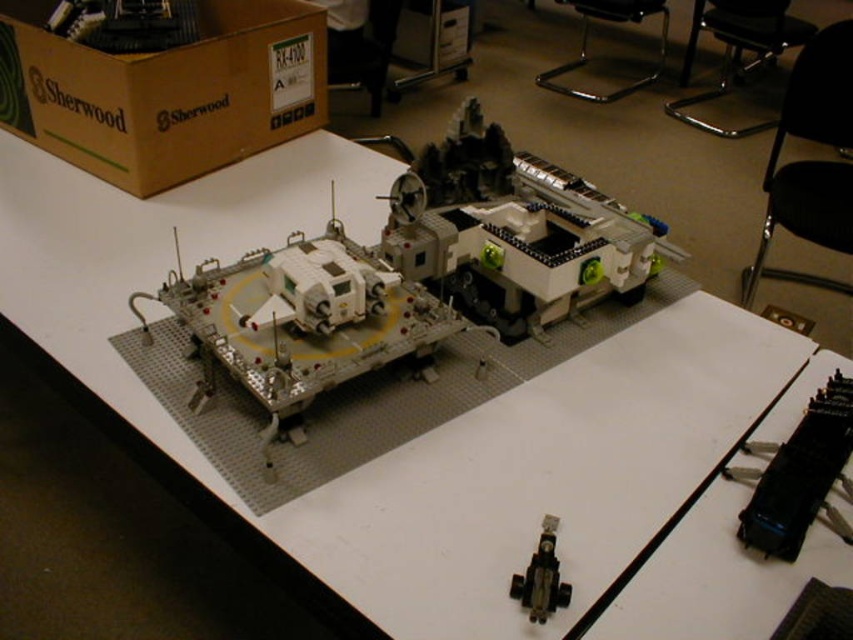
Is beige plastic space vehicle at center wider than white plastic vehicle at center?

Correct, the width of beige plastic space vehicle at center exceeds that of white plastic vehicle at center.

Can you confirm if beige plastic space vehicle at center is positioned to the left of white plastic vehicle at center?

No, beige plastic space vehicle at center is not to the left of white plastic vehicle at center.

Is point (381, 268) positioned before point (396, 349)?

No, (381, 268) is behind (396, 349).

Identify the location of beige plastic space vehicle at center. Image resolution: width=853 pixels, height=640 pixels. (410, 275).

Is the position of brown cardboard box at upper left less distant than that of black plastic train at lower right?

No, it is behind black plastic train at lower right.

The width and height of the screenshot is (853, 640). What do you see at coordinates (165, 92) in the screenshot?
I see `brown cardboard box at upper left` at bounding box center [165, 92].

The width and height of the screenshot is (853, 640). Find the location of `brown cardboard box at upper left`. brown cardboard box at upper left is located at coordinates (165, 92).

Does beige plastic space vehicle at center come behind metallic black usb drive at lower center?

Yes, beige plastic space vehicle at center is behind metallic black usb drive at lower center.

Can you confirm if beige plastic space vehicle at center is positioned below metallic black usb drive at lower center?

Actually, beige plastic space vehicle at center is above metallic black usb drive at lower center.

Where is `beige plastic space vehicle at center`? beige plastic space vehicle at center is located at coordinates (410, 275).